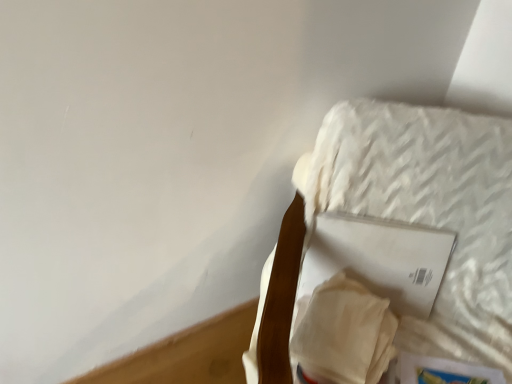
Where is `white matte paper at upper right, which is the first paperback book from top to bottom`? The width and height of the screenshot is (512, 384). white matte paper at upper right, which is the first paperback book from top to bottom is located at coordinates (379, 258).

What do you see at coordinates (379, 258) in the screenshot? I see `white matte paper at upper right, the 2th paperback book when ordered from bottom to top` at bounding box center [379, 258].

What do you see at coordinates (431, 210) in the screenshot?
I see `white textured mattress at upper right` at bounding box center [431, 210].

Find the location of a particular element. The width and height of the screenshot is (512, 384). white matte paper at upper right, which is the first paperback book from top to bottom is located at coordinates (379, 258).

Identify the location of furniture above the hardcover book at lower right, which is counted as the second paperback book, starting from the top (from the image's perspective). The height and width of the screenshot is (384, 512). (431, 210).

Can you confirm if white textured mattress at upper right is thinner than hardcover book at lower right, which is counted as the second paperback book, starting from the top?

No, white textured mattress at upper right is not thinner than hardcover book at lower right, which is counted as the second paperback book, starting from the top.

Based on their sizes in the image, would you say white textured mattress at upper right is bigger or smaller than hardcover book at lower right, positioned as the first paperback book in bottom-to-top order?

Considering their sizes, white textured mattress at upper right takes up more space than hardcover book at lower right, positioned as the first paperback book in bottom-to-top order.

Is white textured mattress at upper right completely or partially outside of hardcover book at lower right, positioned as the first paperback book in bottom-to-top order?

Yes.

From the image's perspective, which object appears higher, white textured mattress at upper right or white matte paper at upper right, which is the first paperback book from top to bottom?

white matte paper at upper right, which is the first paperback book from top to bottom, appears higher in the image.

Between point (476, 206) and point (320, 257), which one is positioned behind?

The point (320, 257) is more distant.

Can white matte paper at upper right, which is the first paperback book from top to bottom, be found inside white textured mattress at upper right?

That's correct, white matte paper at upper right, which is the first paperback book from top to bottom, is inside white textured mattress at upper right.

What's the angular difference between hardcover book at lower right, positioned as the first paperback book in bottom-to-top order, and white textured mattress at upper right's facing directions?

There is a 2.24-degree angle between the facing directions of hardcover book at lower right, positioned as the first paperback book in bottom-to-top order, and white textured mattress at upper right.

Considering the sizes of hardcover book at lower right, positioned as the first paperback book in bottom-to-top order, and white textured mattress at upper right in the image, is hardcover book at lower right, positioned as the first paperback book in bottom-to-top order, taller or shorter than white textured mattress at upper right?

In the image, hardcover book at lower right, positioned as the first paperback book in bottom-to-top order, appears to be shorter than white textured mattress at upper right.

Is hardcover book at lower right, which is counted as the second paperback book, starting from the top, not near white textured mattress at upper right?

They are positioned close to each other.

Is hardcover book at lower right, which is counted as the second paperback book, starting from the top, oriented towards white textured mattress at upper right?

Yes, hardcover book at lower right, which is counted as the second paperback book, starting from the top, is oriented towards white textured mattress at upper right.

Based on the photo, considering the relative positions of white matte paper at upper right, which is the first paperback book from top to bottom, and white textured mattress at upper right in the image provided, is white matte paper at upper right, which is the first paperback book from top to bottom, behind white textured mattress at upper right?

Yes, it is behind white textured mattress at upper right.

In terms of size, does white matte paper at upper right, which is the first paperback book from top to bottom, appear bigger or smaller than white textured mattress at upper right?

Clearly, white matte paper at upper right, which is the first paperback book from top to bottom, is smaller in size than white textured mattress at upper right.

From the image's perspective, which is below, white matte paper at upper right, which is the first paperback book from top to bottom, or white textured mattress at upper right?

white textured mattress at upper right, from the image's perspective.

Find the location of a particular element. Image resolution: width=512 pixels, height=384 pixels. furniture below the white matte paper at upper right, which is the first paperback book from top to bottom (from the image's perspective) is located at coordinates point(431,210).

Between point (402, 362) and point (349, 222), which one is positioned behind?

Point (349, 222)

Are hardcover book at lower right, which is counted as the second paperback book, starting from the top, and white matte paper at upper right, which is the first paperback book from top to bottom, beside each other?

No, hardcover book at lower right, which is counted as the second paperback book, starting from the top, is not in contact with white matte paper at upper right, which is the first paperback book from top to bottom.

In the scene shown: Can we say hardcover book at lower right, which is counted as the second paperback book, starting from the top, lies outside white matte paper at upper right, the 2th paperback book when ordered from bottom to top?

That's correct, hardcover book at lower right, which is counted as the second paperback book, starting from the top, is outside of white matte paper at upper right, the 2th paperback book when ordered from bottom to top.

Between white matte paper at upper right, the 2th paperback book when ordered from bottom to top, and hardcover book at lower right, which is counted as the second paperback book, starting from the top, which one has smaller width?

With smaller width is white matte paper at upper right, the 2th paperback book when ordered from bottom to top.

This screenshot has width=512, height=384. Find the location of `paperback book that is under the white matte paper at upper right, the 2th paperback book when ordered from bottom to top (from a real-world perspective)`. paperback book that is under the white matte paper at upper right, the 2th paperback book when ordered from bottom to top (from a real-world perspective) is located at coordinates [443, 371].

Considering the sizes of white matte paper at upper right, which is the first paperback book from top to bottom, and hardcover book at lower right, positioned as the first paperback book in bottom-to-top order, in the image, is white matte paper at upper right, which is the first paperback book from top to bottom, taller or shorter than hardcover book at lower right, positioned as the first paperback book in bottom-to-top order,?

Considering their sizes, white matte paper at upper right, which is the first paperback book from top to bottom, has more height than hardcover book at lower right, positioned as the first paperback book in bottom-to-top order.

Identify the location of furniture that appears in front of the hardcover book at lower right, positioned as the first paperback book in bottom-to-top order. (431, 210).

Identify the location of the 2nd paperback book behind the white textured mattress at upper right, starting your count from the anchor. This screenshot has height=384, width=512. (379, 258).

In the scene shown: Looking at the image, which one is located closer to hardcover book at lower right, which is counted as the second paperback book, starting from the top, white textured mattress at upper right or white matte paper at upper right, the 2th paperback book when ordered from bottom to top?

white matte paper at upper right, the 2th paperback book when ordered from bottom to top.

Considering their positions, is white matte paper at upper right, which is the first paperback book from top to bottom, positioned further to white textured mattress at upper right than hardcover book at lower right, positioned as the first paperback book in bottom-to-top order?

hardcover book at lower right, positioned as the first paperback book in bottom-to-top order, lies further to white textured mattress at upper right than the other object.

Considering their positions, is white textured mattress at upper right positioned further to white matte paper at upper right, which is the first paperback book from top to bottom, than hardcover book at lower right, which is counted as the second paperback book, starting from the top?

hardcover book at lower right, which is counted as the second paperback book, starting from the top, is positioned further to the anchor white matte paper at upper right, which is the first paperback book from top to bottom.

From the image, which object appears to be nearer to hardcover book at lower right, positioned as the first paperback book in bottom-to-top order, white matte paper at upper right, which is the first paperback book from top to bottom, or white textured mattress at upper right?

The object closer to hardcover book at lower right, positioned as the first paperback book in bottom-to-top order, is white matte paper at upper right, which is the first paperback book from top to bottom.

Based on their spatial positions, is hardcover book at lower right, positioned as the first paperback book in bottom-to-top order, or white matte paper at upper right, the 2th paperback book when ordered from bottom to top, further from white textured mattress at upper right?

The object further to white textured mattress at upper right is hardcover book at lower right, positioned as the first paperback book in bottom-to-top order.

Looking at this image, which object lies nearer to the anchor point white matte paper at upper right, which is the first paperback book from top to bottom, hardcover book at lower right, positioned as the first paperback book in bottom-to-top order, or white textured mattress at upper right?

white textured mattress at upper right lies closer to white matte paper at upper right, which is the first paperback book from top to bottom, than the other object.

Find the location of a particular element. Image resolution: width=512 pixels, height=384 pixels. paperback book between white textured mattress at upper right and white matte paper at upper right, which is the first paperback book from top to bottom, along the z-axis is located at coordinates (443, 371).